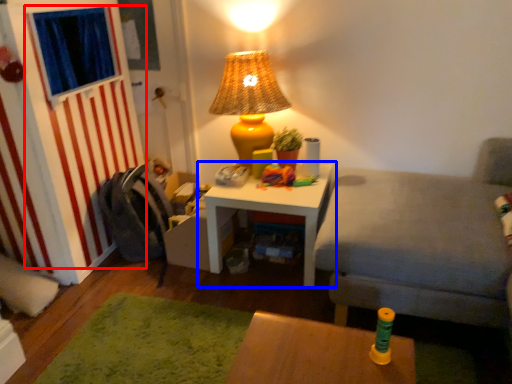
Question: Among these objects, which one is farthest to the camera, curtain (highlighted by a red box) or table (highlighted by a blue box)?

Choices:
 (A) curtain
 (B) table

Answer: (B)